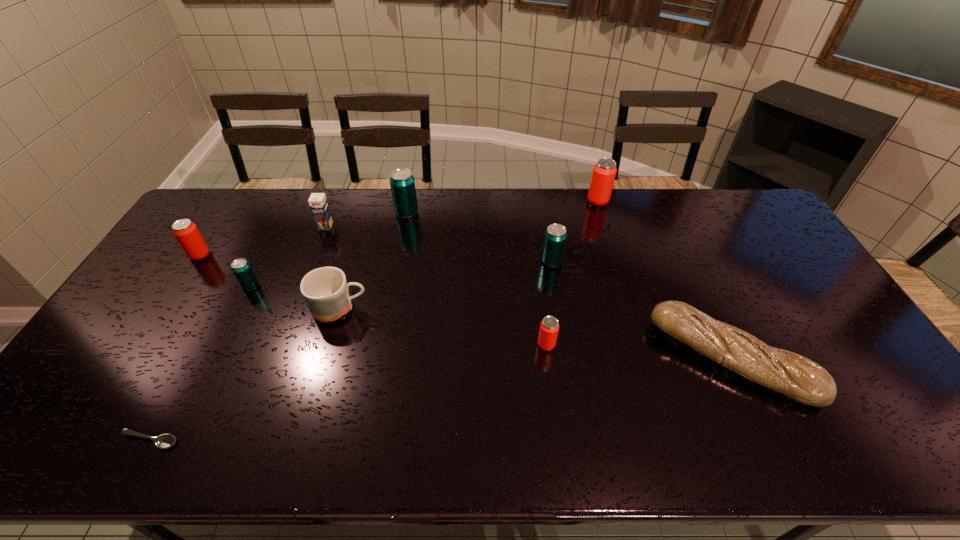
Identify the location of red beer can that stands as the second closest to the chocolate milk. (549, 327).

Identify which red beer can is the third nearest to the fifth beer can from right to left. Please provide its 2D coordinates. Your answer should be formatted as a tuple, i.e. [(x, y)], where the tuple contains the x and y coordinates of a point satisfying the conditions above.

[(604, 171)]

At what (x,y) coordinates should I click in order to perform the action: click on teal beer can that can be found as the third closest to the leftmost beer can. Please return your answer as a coordinate pair (x, y). The height and width of the screenshot is (540, 960). Looking at the image, I should click on (555, 237).

Select which teal beer can is the closest to the smallest teal beer can. Please provide its 2D coordinates. Your answer should be formatted as a tuple, i.e. [(x, y)], where the tuple contains the x and y coordinates of a point satisfying the conditions above.

[(402, 182)]

Where is `free point that satisfies the following two spatial constraints: 1. on the side with the handle of the blue mug; 2. on the left side of the second red beer can from right to left`? free point that satisfies the following two spatial constraints: 1. on the side with the handle of the blue mug; 2. on the left side of the second red beer can from right to left is located at coordinates (330, 345).